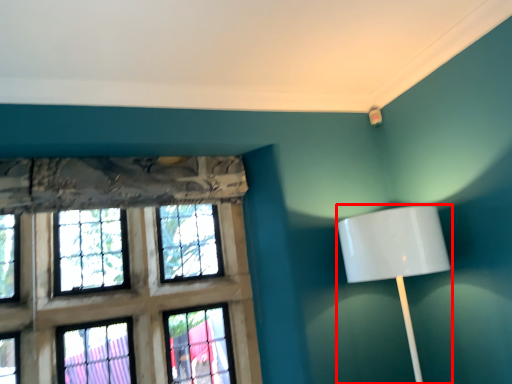
Question: Considering the relative positions of lamp (annotated by the red box) and window in the image provided, where is lamp (annotated by the red box) located with respect to the staircase?

Choices:
 (A) left
 (B) right

Answer: (B)